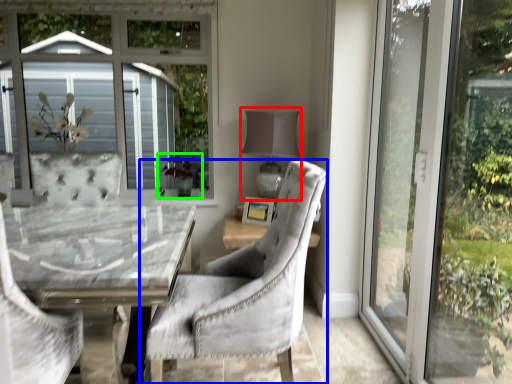
Question: Considering the real-world distances, which object is closest to table lamp (highlighted by a red box)? chair (highlighted by a blue box) or plant (highlighted by a green box).

Choices:
 (A) chair
 (B) plant

Answer: (B)